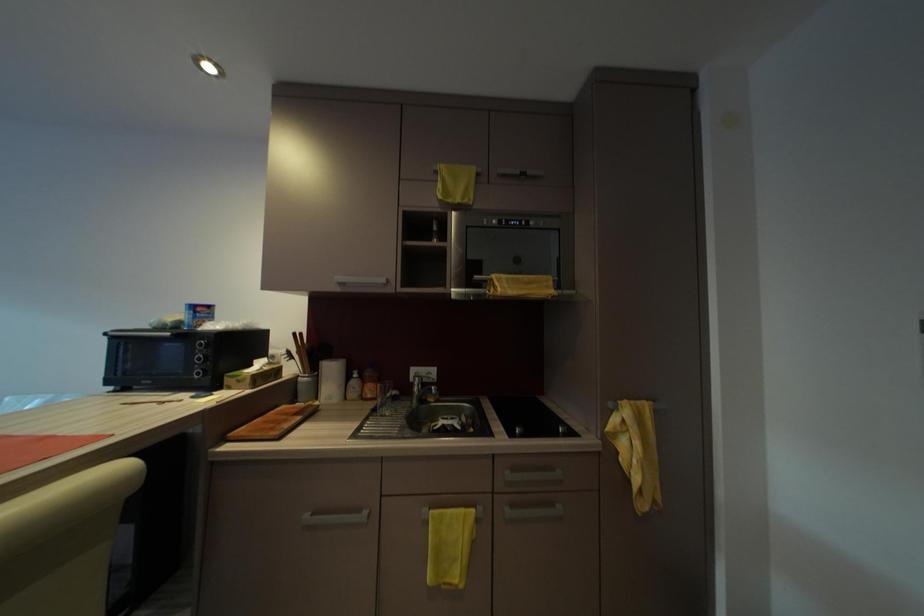
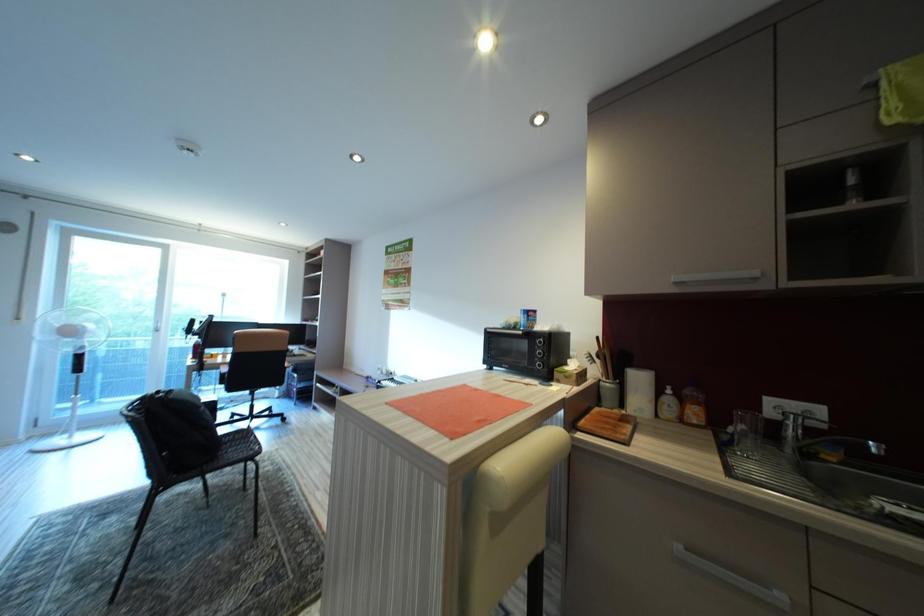
Question: The camera is either moving clockwise (left) or counter-clockwise (right) around the object. The first image is from the beginning of the video and the second image is from the end. Is the camera moving left or right when shooting the video?

Choices:
 (A) Left
 (B) Right

Answer: (B)